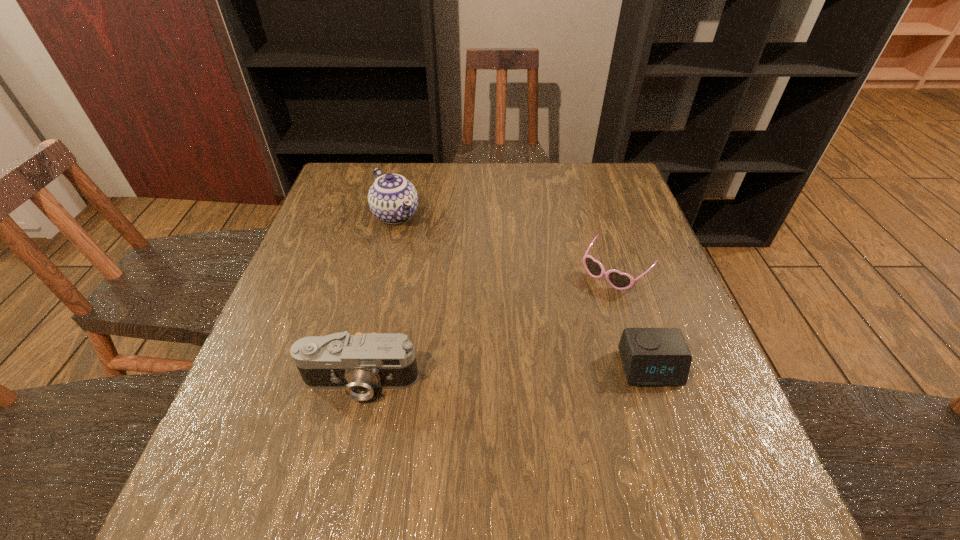
The image size is (960, 540). In order to click on vacant space that's between the chinaware and the shortest object in this screenshot , I will do pyautogui.click(x=506, y=243).

I want to click on free space between the sunglasses and the alarm clock, so click(x=633, y=320).

Identify the location of free point between the shortest object and the camera. The image size is (960, 540). (488, 327).

You are a GUI agent. You are given a task and a screenshot of the screen. Output one action in this format:
    pyautogui.click(x=<x>, y=<y>)
    Task: Click on the vacant area that lies between the tallest object and the camera
    The image size is (960, 540).
    Given the screenshot: What is the action you would take?
    pyautogui.click(x=378, y=299)

Find the location of a particular element. vacant space that is in between the alarm clock and the camera is located at coordinates (505, 375).

I want to click on vacant area that lies between the second shortest object and the chinaware, so click(523, 292).

This screenshot has width=960, height=540. What are the coordinates of `vacant area that lies between the alarm clock and the chinaware` in the screenshot? It's located at (523, 292).

You are a GUI agent. You are given a task and a screenshot of the screen. Output one action in this format:
    pyautogui.click(x=<x>, y=<y>)
    Task: Click on the free point between the farthest object and the alarm clock
    Image resolution: width=960 pixels, height=540 pixels.
    Given the screenshot: What is the action you would take?
    pyautogui.click(x=523, y=292)

Locate an element on the screen. This screenshot has height=540, width=960. vacant point located between the shortest object and the alarm clock is located at coordinates (633, 320).

Point out which object is positioned as the third nearest to the farthest object. Please provide its 2D coordinates. Your answer should be formatted as a tuple, i.e. [(x, y)], where the tuple contains the x and y coordinates of a point satisfying the conditions above.

[(652, 357)]